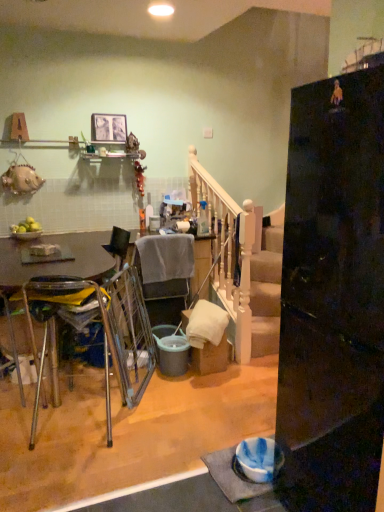
Image resolution: width=384 pixels, height=512 pixels. I want to click on vacant area in front of metallic silver swivel chair at center, so click(x=158, y=419).